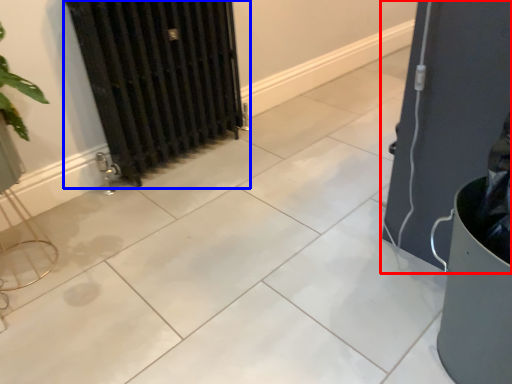
Question: Which point is closer to the camera, door (highlighted by a red box) or radiator (highlighted by a blue box)?

Choices:
 (A) door
 (B) radiator

Answer: (A)